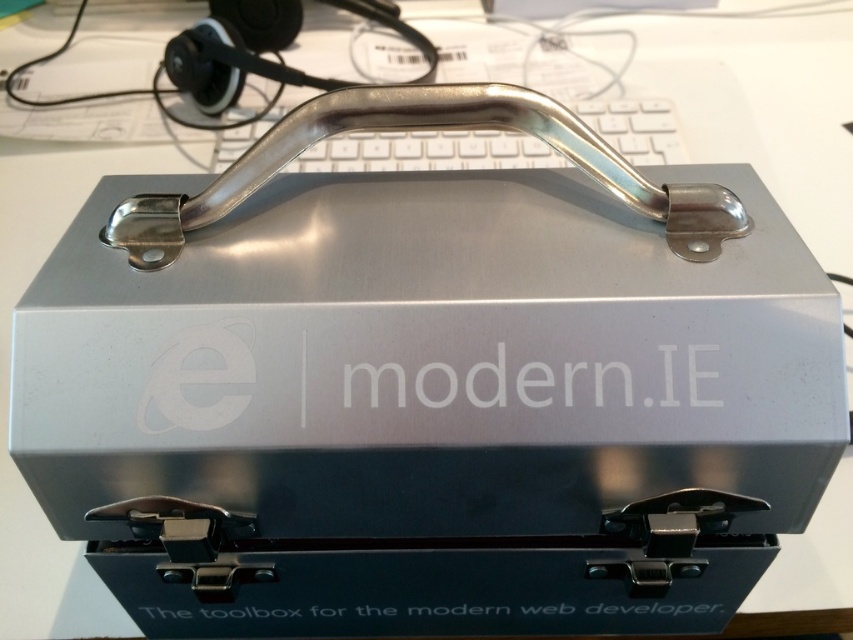
Does white plastic keyboard at center appear on the left side of matte black earphone at upper left?

In fact, white plastic keyboard at center is to the right of matte black earphone at upper left.

Which is more to the left, white plastic keyboard at center or matte black earphone at upper left?

matte black earphone at upper left

Measure the distance between point (x=479, y=157) and camera.

Point (x=479, y=157) is 4.16 feet from camera.

Image resolution: width=853 pixels, height=640 pixels. Find the location of `white plastic keyboard at center`. white plastic keyboard at center is located at coordinates (426, 150).